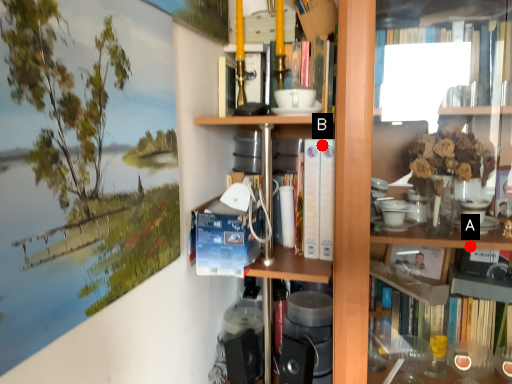
Question: Two points are circled on the image, labeled by A and B beside each circle. Which point is further to the camera?

Choices:
 (A) A is further
 (B) B is further

Answer: (B)